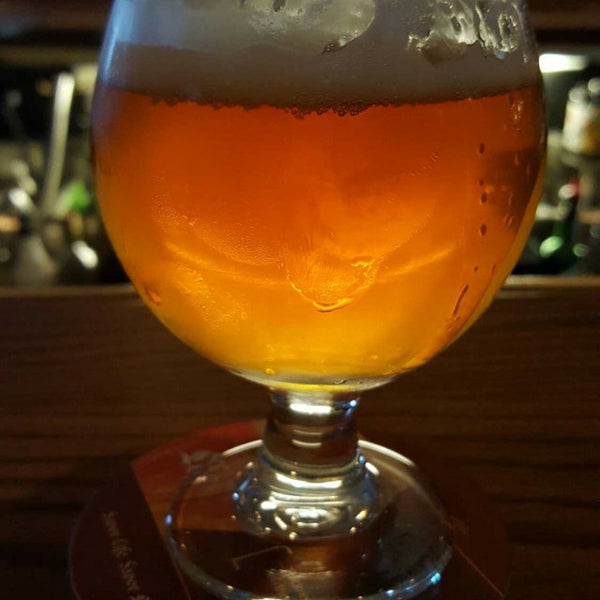
I want to click on left back edge table, so click(60, 294).